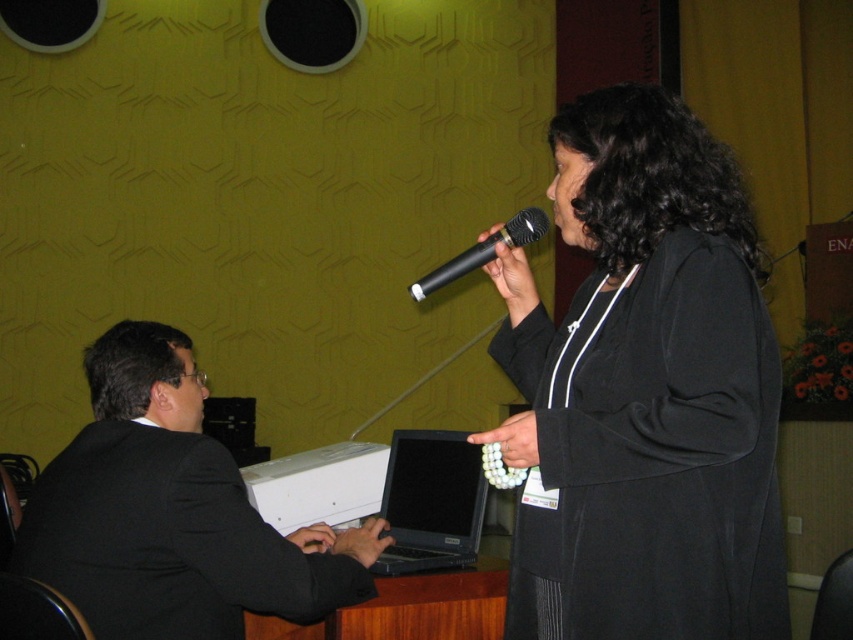
You are attending a conference and need to pass a document to the presenter holding the black matte microphone at upper center. The seated person in the black suit at left is in your way. Can you reach the presenter without moving the seated person?

Result: The black suit at left is positioned under the black matte microphone at upper center, meaning the seated person is directly below the presenter. Since the seated person is under the presenter, you can likely reach the presenter by moving around the seated individual to the side or behind them, as their position does not block the path directly to the presenter.

You are setting up a presentation room and need to place the black matte laptop at lower center and the black matte microphone at upper center on a shelf. The shelf has a height limit of 10 cm. Which object will exceed the height limit?

The black matte laptop at lower center is much taller than the black matte microphone at upper center. Therefore, the black matte laptop at lower center will exceed the shelf height limit of 10 cm.

You are organizing a conference and need to position a new speaker between the black suit at left and the black matte microphone at upper center. Based on their current positions, where should you place the new speaker to maintain the existing spatial arrangement?

The new speaker should be placed between the black suit at left and the black matte microphone at upper center, as the black suit at left is already positioned to the left of the black matte microphone at upper center.